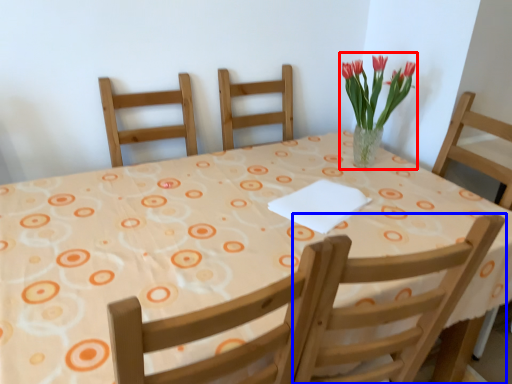
Question: Which of the following is the closest to the observer, floral arrangement (highlighted by a red box) or chair (highlighted by a blue box)?

Choices:
 (A) floral arrangement
 (B) chair

Answer: (B)